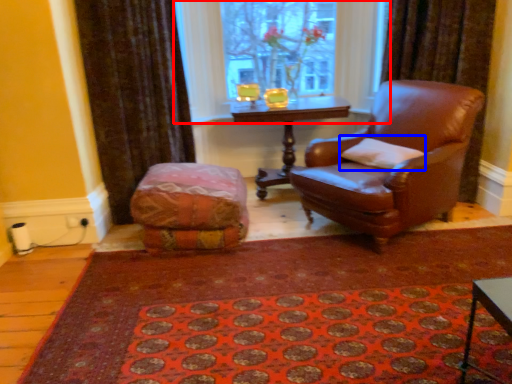
Question: Which point is closer to the camera, window (highlighted by a red box) or pillow (highlighted by a blue box)?

Choices:
 (A) window
 (B) pillow

Answer: (B)